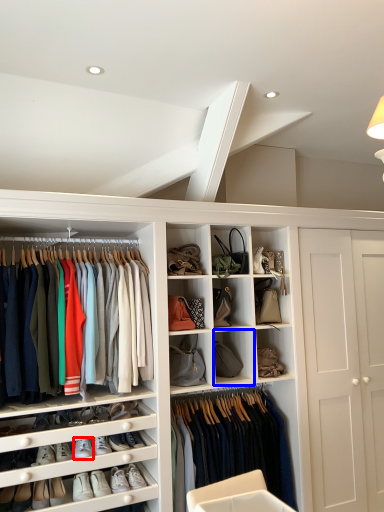
Question: Which point is further to the camera, footwear (highlighted by a red box) or cabinet (highlighted by a blue box)?

Choices:
 (A) footwear
 (B) cabinet

Answer: (B)